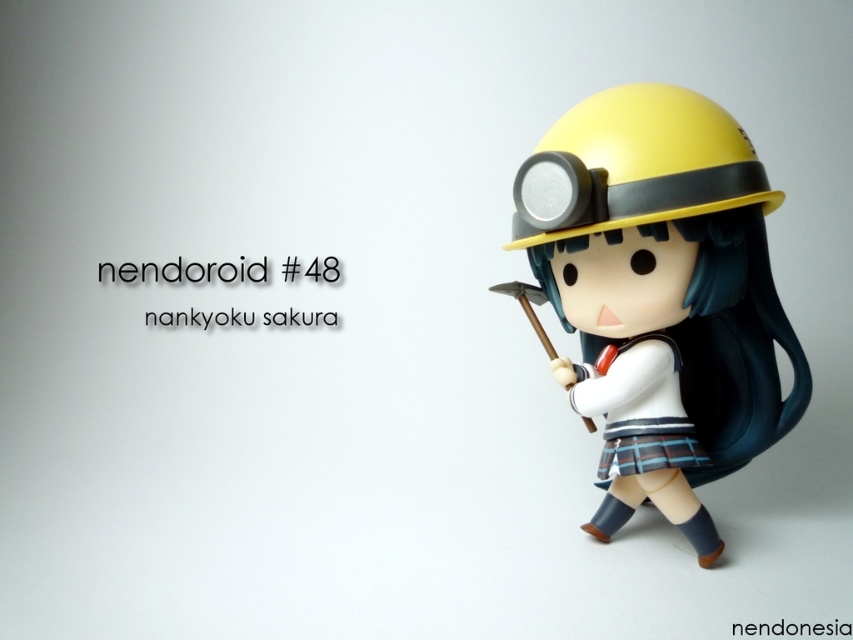
You are a collector examining the Nendoroid figurine of Nankyoku Sakura. You notice two points on the figurine marked at coordinates point (642,314) and point (534,221). Which of these points is closer to your line of sight?

Point (642,314) is further to the viewer than point (534,221), so the point closer to your line of sight is point (534,221).

In the scene shown: You are a collector organizing your Nendoroid display. You have two yellow helmets in the scene. Which one is wider? The matte yellow helmet at upper right or the yellow matte helmet at upper center?

The matte yellow helmet at upper right is wider than the yellow matte helmet at upper center.